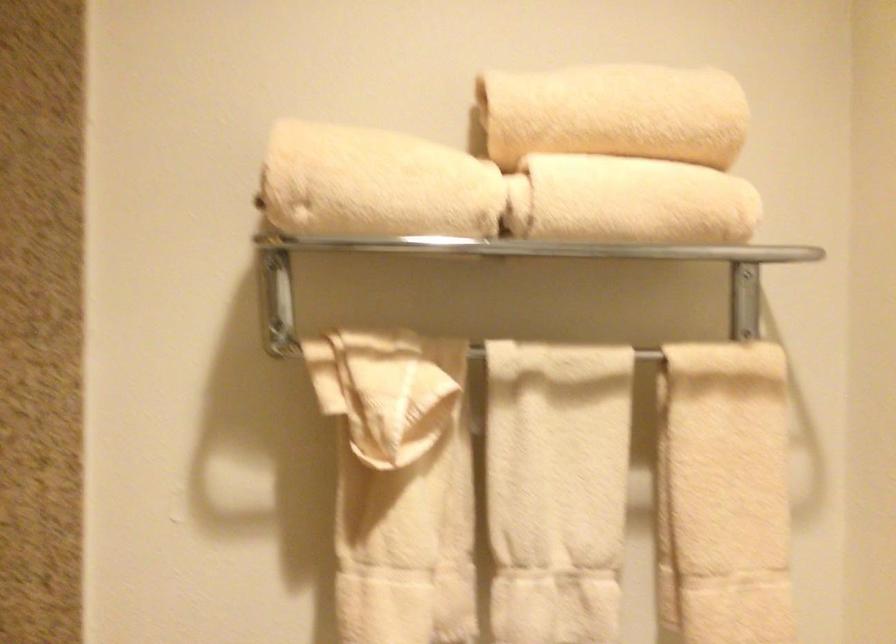
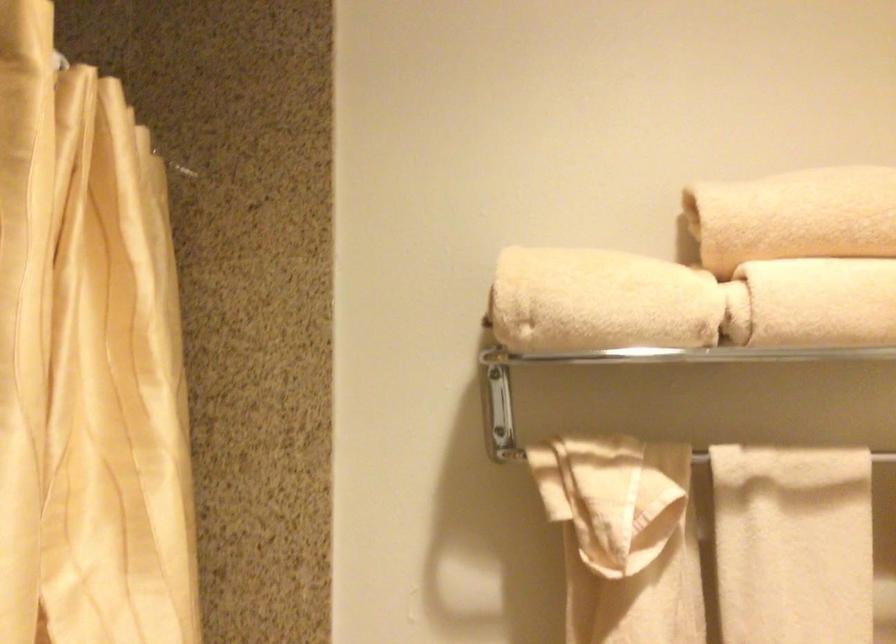
What movement of the cameraman would produce the second image?

The cameraman walked toward left, backward.